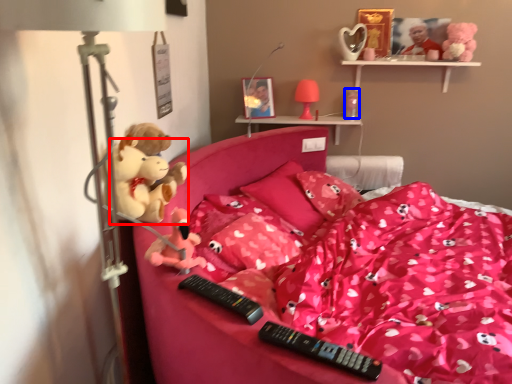
Question: Which object appears farthest to the camera in this image, toy (highlighted by a red box) or toy (highlighted by a blue box)?

Choices:
 (A) toy
 (B) toy

Answer: (B)